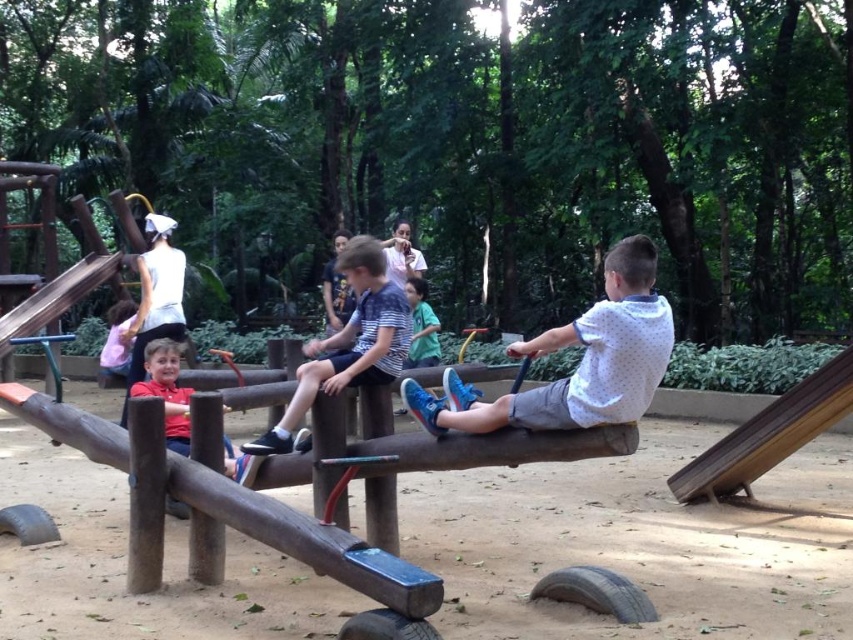
Question: Which point is closer to the camera?

Choices:
 (A) (614, 360)
 (B) (412, 337)
 (C) (125, 326)

Answer: (A)

Question: Among these objects, which one is nearest to the camera?

Choices:
 (A) pink fabric dress at lower left
 (B) wooden slide at upper left
 (C) green matte shirt at center
 (D) striped cotton shirt at center

Answer: (D)

Question: Does green matte shirt at center have a greater width compared to pink fabric dress at lower left?

Choices:
 (A) no
 (B) yes

Answer: (A)

Question: From the image, what is the correct spatial relationship of white dotted shirt at center in relation to striped cotton shirt at center?

Choices:
 (A) below
 (B) above

Answer: (B)

Question: Which of these objects is positioned closest to the wooden slide at upper left?

Choices:
 (A) green matte shirt at center
 (B) white dotted shirt at center
 (C) pink fabric dress at lower left
 (D) striped cotton shirt at center

Answer: (C)

Question: Is wooden slide at upper left below green matte shirt at center?

Choices:
 (A) no
 (B) yes

Answer: (A)